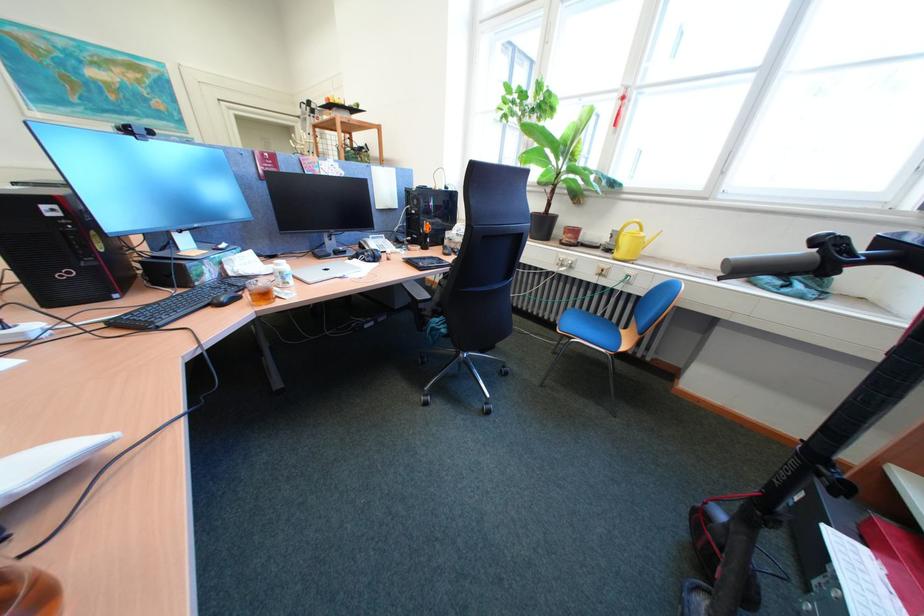
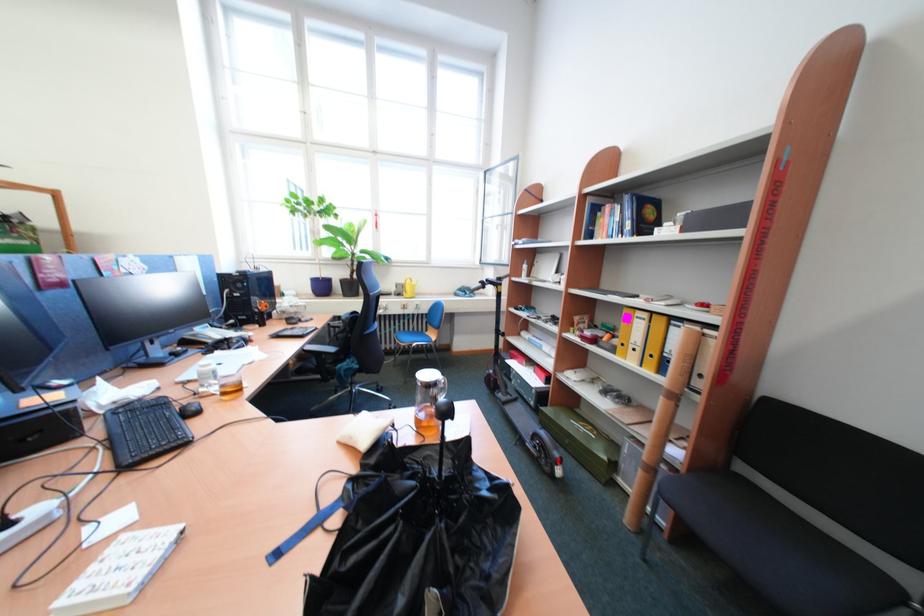
The point at [611,249] is marked in the first image. Where is the corresponding point in the second image?

(403, 296)